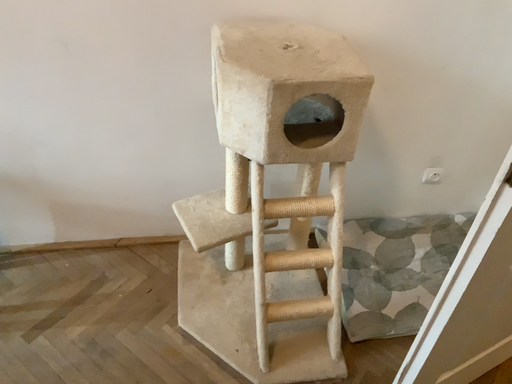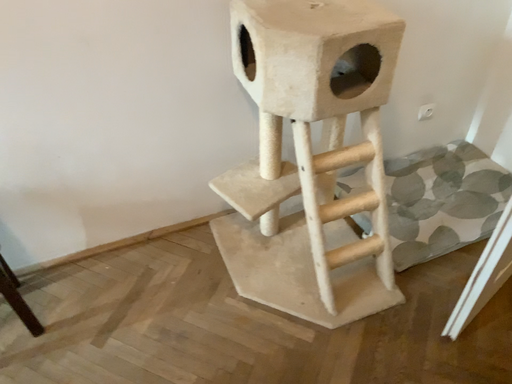
Question: How did the camera likely rotate when shooting the video?

Choices:
 (A) rotated right
 (B) rotated left

Answer: (A)